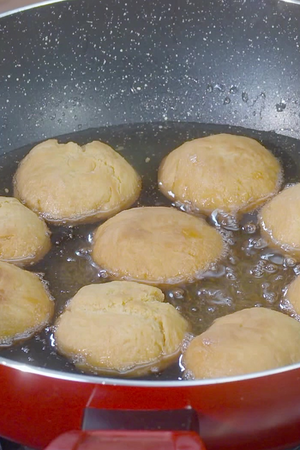
You are a GUI agent. You are given a task and a screenshot of the screen. Output one action in this format:
    pyautogui.click(x=<x>, y=<y>)
    Task: Click on the block that connects handle to pan
    
    Given the screenshot: What is the action you would take?
    pyautogui.click(x=164, y=419)